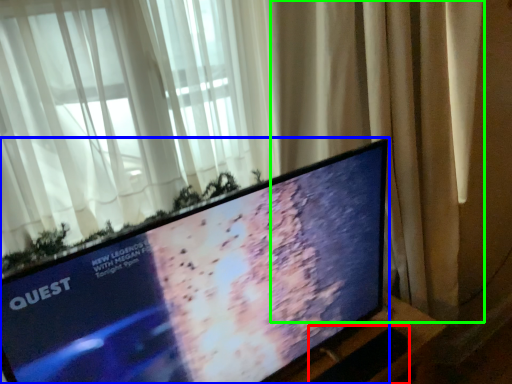
Question: Which object is the farthest from laptop keyboard (highlighted by a red box)? Choose among these: television (highlighted by a blue box) or curtain (highlighted by a green box).

Choices:
 (A) television
 (B) curtain

Answer: (B)